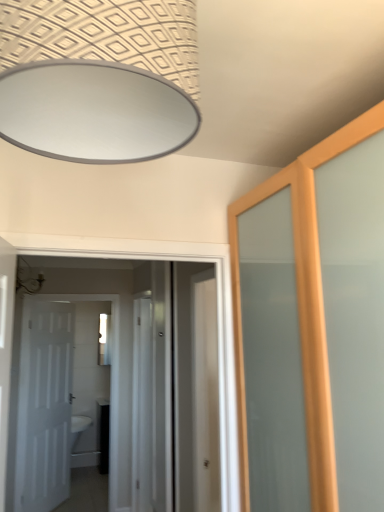
This screenshot has height=512, width=384. Identify the location of empty space that is ontop of white glossy door at left, the second door when ordered from right to left (from a real-world perspective). (79, 292).